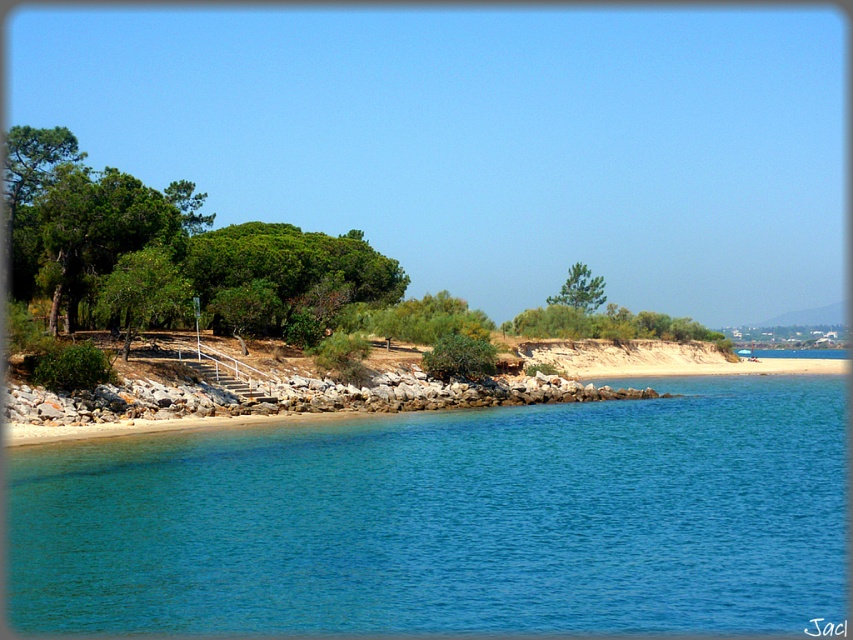
Can you confirm if green leafy trees at left is positioned to the left of smooth sand beach at lower center?

Indeed, green leafy trees at left is positioned on the left side of smooth sand beach at lower center.

Does green leafy trees at left have a lesser height compared to smooth sand beach at lower center?

In fact, green leafy trees at left may be taller than smooth sand beach at lower center.

Does point (55, 193) come farther from viewer compared to point (322, 387)?

No.

Locate an element on the screen. The width and height of the screenshot is (853, 640). green leafy trees at left is located at coordinates (155, 234).

Who is shorter, clear blue water at lower left or smooth sand beach at lower center?

clear blue water at lower left

Find the location of `clear blue water at lower left`. clear blue water at lower left is located at coordinates (450, 520).

The width and height of the screenshot is (853, 640). Identify the location of clear blue water at lower left. (450, 520).

Who is shorter, smooth sand beach at lower center or green textured tree at center?

Standing shorter between the two is smooth sand beach at lower center.

Who is positioned more to the right, smooth sand beach at lower center or green textured tree at center?

From the viewer's perspective, green textured tree at center appears more on the right side.

Find the location of a particular element. The image size is (853, 640). smooth sand beach at lower center is located at coordinates (367, 388).